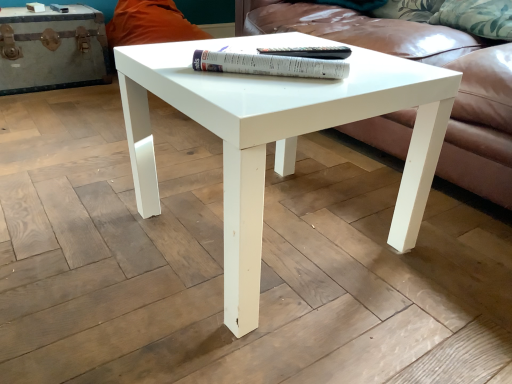
Question: Is point (125, 46) closer or farther from the camera than point (246, 71)?

Choices:
 (A) farther
 (B) closer

Answer: (A)

Question: From a real-world perspective, relative to white paper at center, which ranks as the 1th paperback book in front-to-back order, is white glossy coffee table at center vertically above or below?

Choices:
 (A) below
 (B) above

Answer: (A)

Question: Estimate the real-world distances between objects in this image. Which object is closer to the paperback book at center, which ranks as the first paperback book in back-to-front order?

Choices:
 (A) leather couch at center
 (B) white leather chest at left
 (C) white paper at center, which ranks as the 1th paperback book in front-to-back order
 (D) white glossy coffee table at center

Answer: (C)

Question: Based on their relative distances, which object is nearer to the white glossy coffee table at center?

Choices:
 (A) paperback book at center, placed as the 2th paperback book when sorted from front to back
 (B) white paper at center, which ranks as the 1th paperback book in front-to-back order
 (C) leather couch at center
 (D) white leather chest at left

Answer: (B)